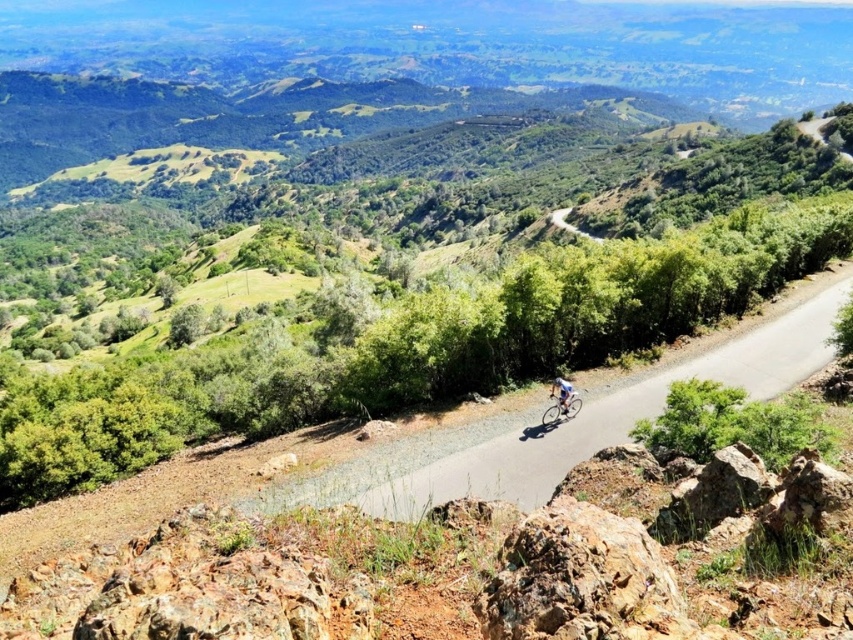
Can you confirm if asphalt road at center is wider than shiny blue frame at center?

Indeed, asphalt road at center has a greater width compared to shiny blue frame at center.

Is point (589, 404) closer to camera compared to point (567, 396)?

No, it is not.

Locate an element on the screen. The height and width of the screenshot is (640, 853). asphalt road at center is located at coordinates (560, 424).

Can you confirm if asphalt road at center is shorter than light blue fabric cyclist at center?

Incorrect, asphalt road at center's height does not fall short of light blue fabric cyclist at center's.

Is asphalt road at center to the right of light blue fabric cyclist at center from the viewer's perspective?

Yes, asphalt road at center is to the right of light blue fabric cyclist at center.

The image size is (853, 640). In order to click on asphalt road at center in this screenshot , I will do `click(560, 424)`.

The height and width of the screenshot is (640, 853). What are the coordinates of `asphalt road at center` in the screenshot? It's located at (560, 424).

Is shiny blue frame at center to the right of light blue fabric cyclist at center from the viewer's perspective?

Incorrect, shiny blue frame at center is not on the right side of light blue fabric cyclist at center.

Does shiny blue frame at center appear under light blue fabric cyclist at center?

Correct, shiny blue frame at center is located below light blue fabric cyclist at center.

What do you see at coordinates (561, 410) in the screenshot?
I see `shiny blue frame at center` at bounding box center [561, 410].

Find the location of a particular element. Image resolution: width=853 pixels, height=640 pixels. shiny blue frame at center is located at coordinates (561, 410).